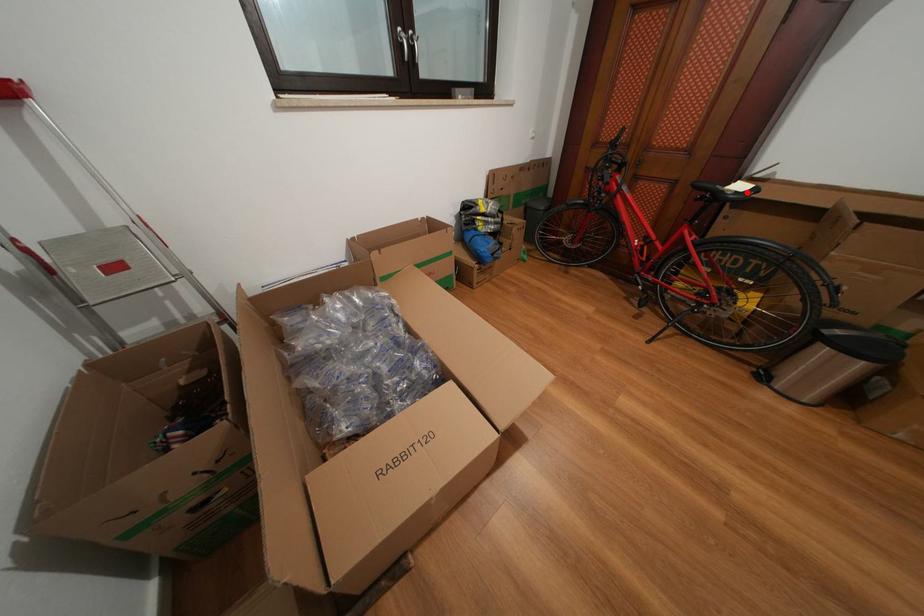
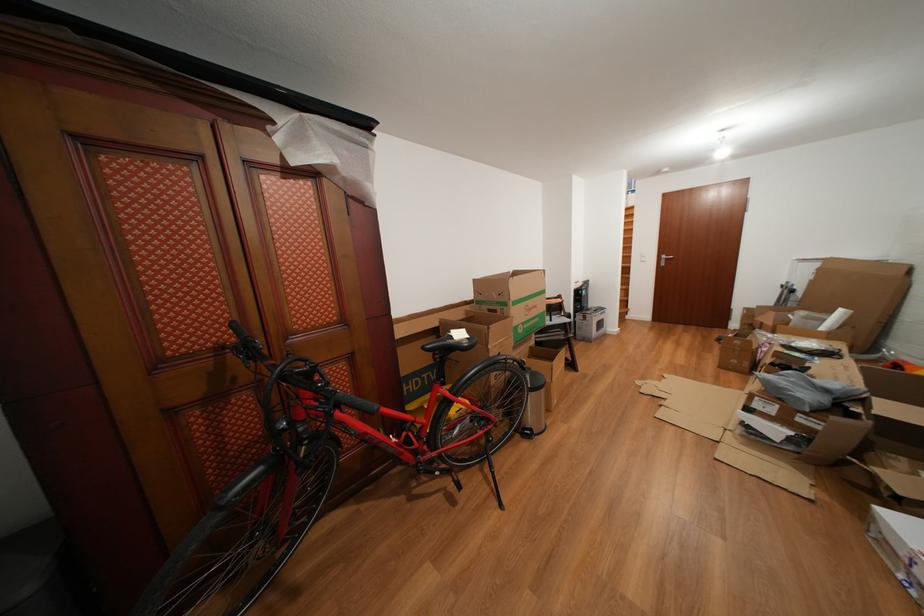
In the second image, find the point that corresponds to the highlighted location in the first image.

(468, 339)